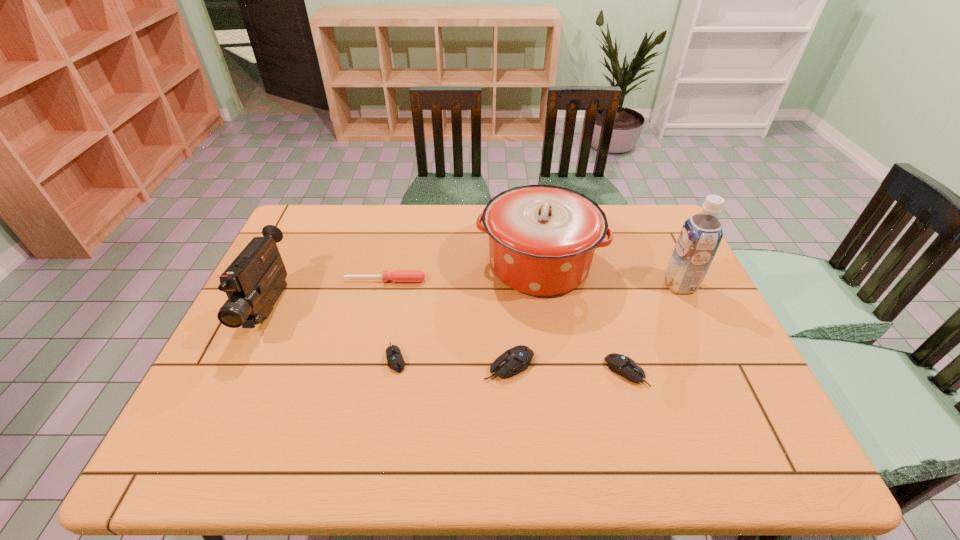
The width and height of the screenshot is (960, 540). In order to click on free point located on the right of the tallest computer mouse in this screenshot , I will do `click(623, 365)`.

This screenshot has width=960, height=540. Find the location of `vacant area situated on the back of the second shortest computer mouse`. vacant area situated on the back of the second shortest computer mouse is located at coordinates (612, 323).

In order to click on free space located 0.060m on the left of the casserole in this screenshot , I will do `click(457, 265)`.

Where is `vacant space located on the label of the tallest object`? The height and width of the screenshot is (540, 960). vacant space located on the label of the tallest object is located at coordinates (540, 285).

I want to click on free spot located on the label of the tallest object, so click(554, 285).

Where is `vacant space located 0.080m on the label of the tallest object`? vacant space located 0.080m on the label of the tallest object is located at coordinates (638, 285).

Identify the location of vacant area situated 0.100m on the front-facing side of the leftmost object. The width and height of the screenshot is (960, 540). (232, 384).

I want to click on vacant space located 0.160m on the back of the screwdriver, so click(394, 244).

Locate an element on the screen. Image resolution: width=960 pixels, height=540 pixels. object that is positioned at the far edge is located at coordinates (542, 238).

The height and width of the screenshot is (540, 960). I want to click on object that is at the near edge, so click(x=622, y=365).